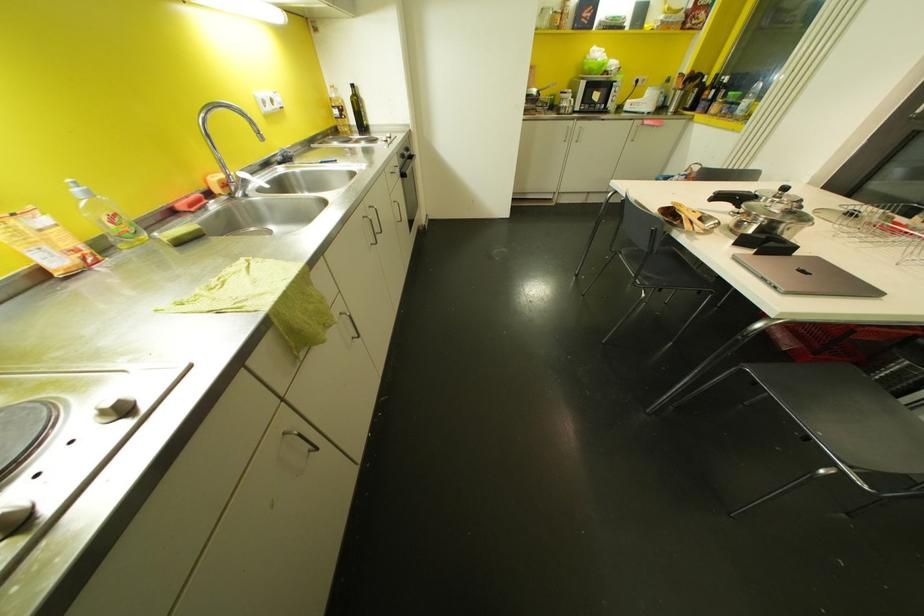
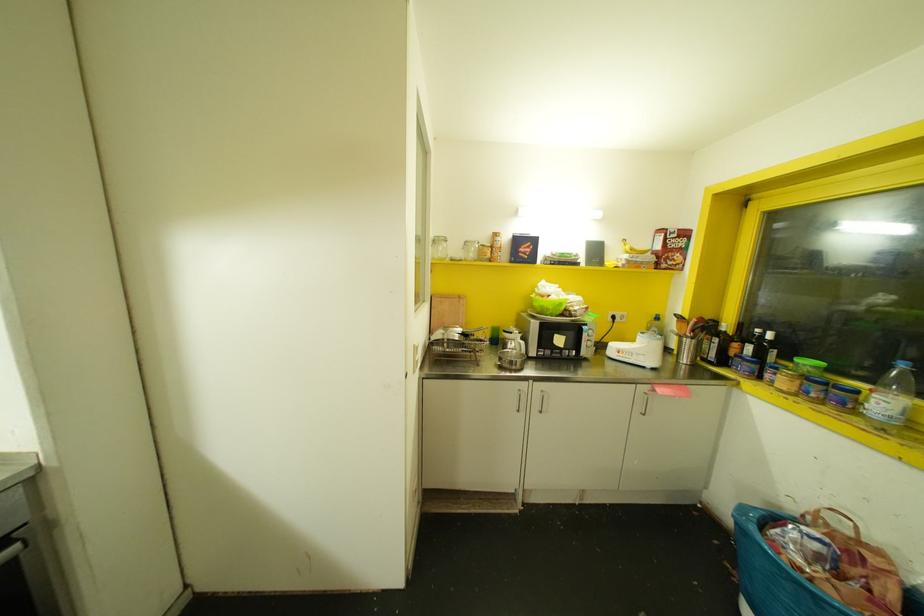
Locate, in the second image, the point that corresponds to point (693, 106) in the first image.

(723, 361)